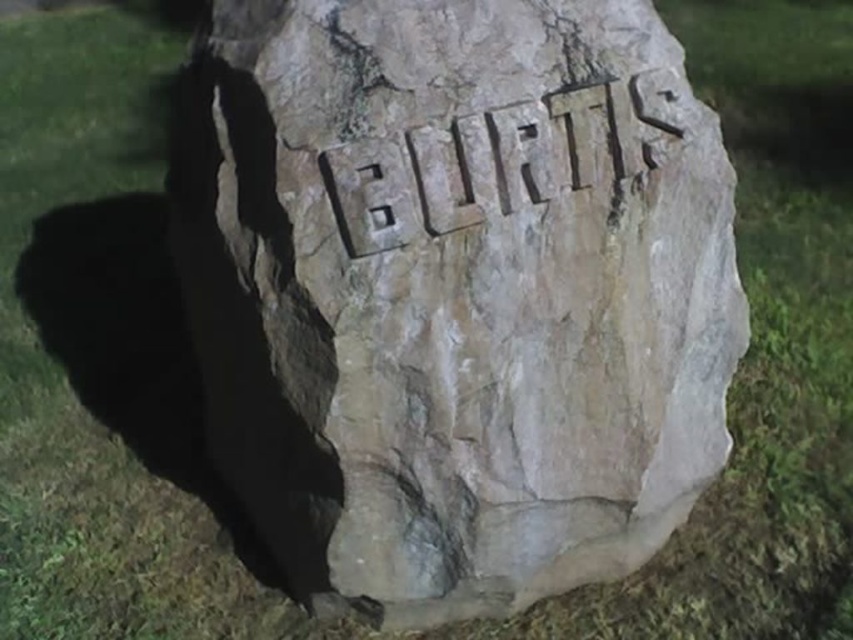
Is brown rough stone at center above carved stone name at center?

Actually, brown rough stone at center is below carved stone name at center.

Is brown rough stone at center to the right of carved stone name at center from the viewer's perspective?

In fact, brown rough stone at center is to the left of carved stone name at center.

Where is `brown rough stone at center`? brown rough stone at center is located at coordinates (456, 291).